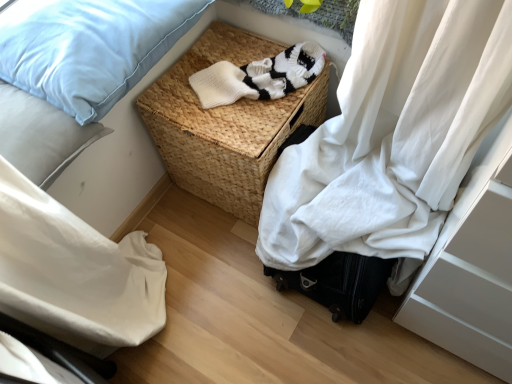
The height and width of the screenshot is (384, 512). Identify the location of free space between woven brown picnic basket at center and black hard suitcase at lower right. (224, 237).